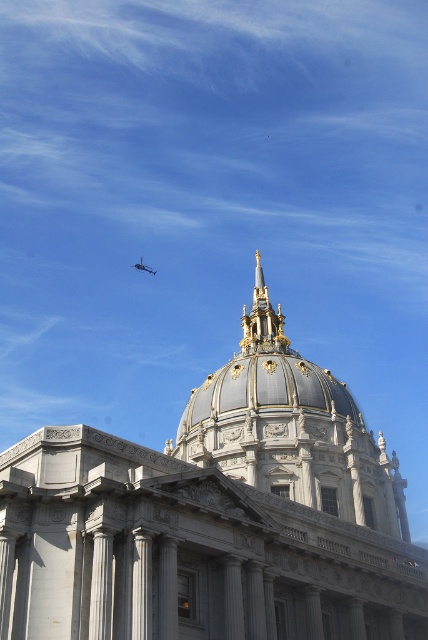
Question: Does white stone dome at center have a smaller size compared to gold/gilded spire at upper center?

Choices:
 (A) yes
 (B) no

Answer: (B)

Question: Which of the following is the closest to the observer?

Choices:
 (A) metallic gray helicopter at upper center
 (B) gold/gilded spire at upper center
 (C) white stone dome at center

Answer: (C)

Question: Which object is positioned closest to the metallic gray helicopter at upper center?

Choices:
 (A) white stone dome at center
 (B) gold/gilded spire at upper center

Answer: (B)

Question: Which is nearer to the metallic gray helicopter at upper center?

Choices:
 (A) gold/gilded spire at upper center
 (B) white stone dome at center

Answer: (A)

Question: In this image, where is gold/gilded spire at upper center located relative to metallic gray helicopter at upper center?

Choices:
 (A) above
 (B) below

Answer: (B)

Question: Does white stone dome at center come behind gold/gilded spire at upper center?

Choices:
 (A) no
 (B) yes

Answer: (A)